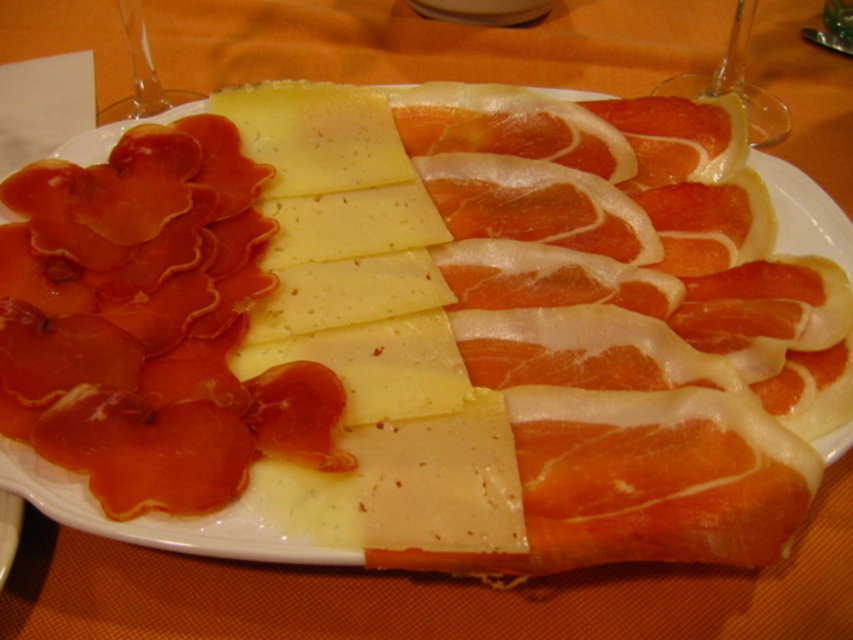
You are looking at the charcuterie board on the table. There are two points marked on the board at coordinates point (368, 237) and point (126, 104). Which point is closer to you?

Point (368, 237) is closer to the viewer than point (126, 104).

You are arranging a charcuterie board and want to place a new fruit bowl between the yellow cheese at center and the transparent glass at upper left. Based on their current positions, where should you place the fruit bowl?

The fruit bowl should be placed between the yellow cheese at center and the transparent glass at upper left, to the left of the yellow cheese at center since the yellow cheese at center is positioned on the right side of the transparent glass at upper left.